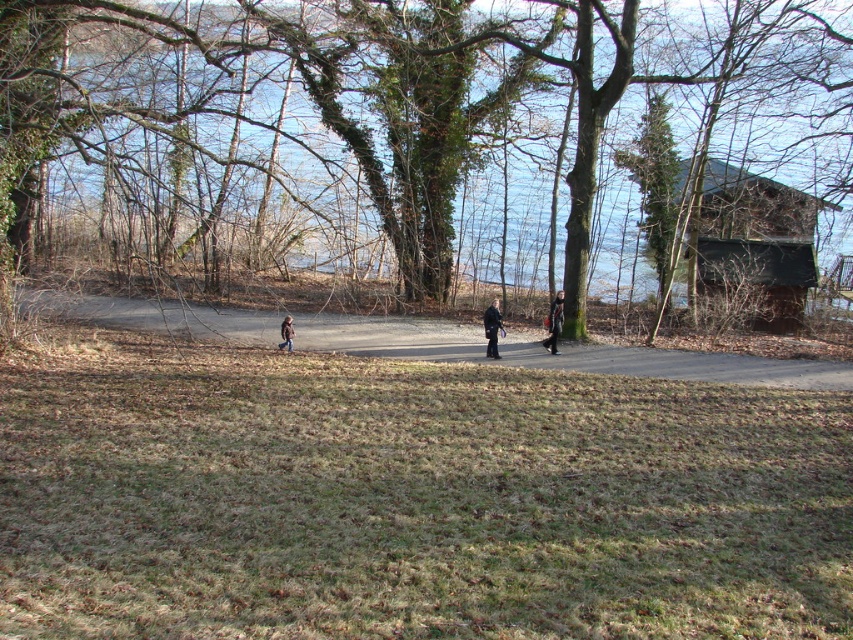
You are standing at the dirt road at center and want to walk to the paved path that is 15.04 meters away. Is the paved path closer to you than the dirt road?

The paved path is 15.04 meters away from the dirt road at center, so the paved path is farther away than the dirt road at center.

You are standing on the grassy area with patches of dry brown grass and want to join the two people walking on the paved path. Which direction should you walk to reach the dark gray jacket at center first while avoiding the brown fuzzy jacket at center?

To reach the dark gray jacket at center first while avoiding the brown fuzzy jacket at center, you should walk towards the right side of the path since the dark gray jacket at center is positioned on the right side of the brown fuzzy jacket at center.